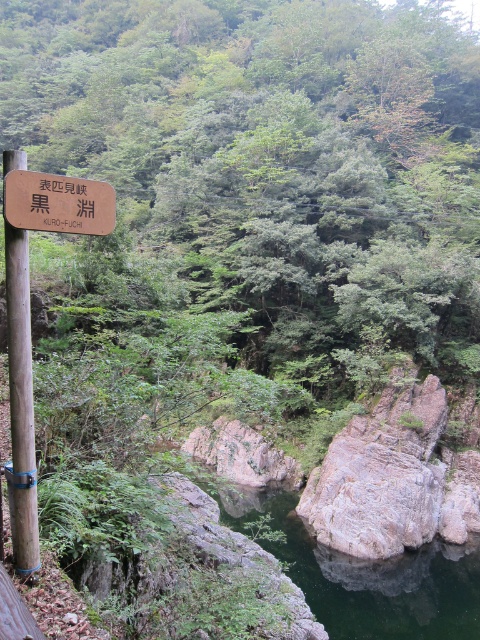
Question: Does green smooth rock at center appear over brown wooden sign at upper left?

Choices:
 (A) no
 (B) yes

Answer: (A)

Question: Based on their relative distances, which object is nearer to the green smooth rock at center?

Choices:
 (A) brown wooden sign at upper left
 (B) brown wooden pole at left

Answer: (B)

Question: Which point appears closest to the camera in this image?

Choices:
 (A) (12, 262)
 (B) (88, 192)

Answer: (A)

Question: Does green smooth rock at center have a lesser width compared to brown wooden sign at upper left?

Choices:
 (A) yes
 (B) no

Answer: (B)

Question: Which point appears farthest from the camera in this image?

Choices:
 (A) (28, 202)
 (B) (15, 461)

Answer: (B)

Question: Does green smooth rock at center appear over brown wooden sign at upper left?

Choices:
 (A) yes
 (B) no

Answer: (B)